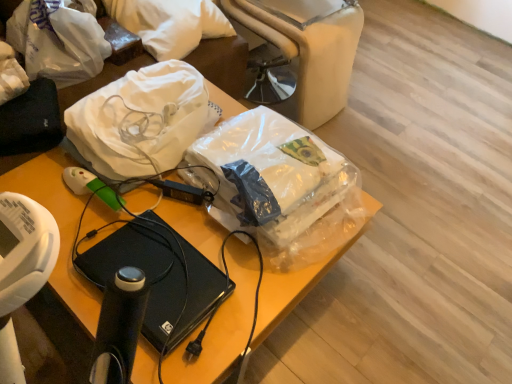
Question: Is translucent plastic bag at center, positioned as the 3th plastic bag in left-to-right order, aimed at white matte plastic bag at upper left, which ranks as the 3th plastic bag in right-to-left order?

Choices:
 (A) yes
 (B) no

Answer: (B)

Question: Is the position of translucent plastic bag at center, positioned as the 3th plastic bag in left-to-right order, less distant than that of white matte plastic bag at upper left, which is the 1th plastic bag in left-to-right order?

Choices:
 (A) no
 (B) yes

Answer: (B)

Question: From the image's perspective, would you say translucent plastic bag at center, which appears as the 1th plastic bag when viewed from the right, is shown under white matte plastic bag at upper left, which is the 1th plastic bag in left-to-right order?

Choices:
 (A) yes
 (B) no

Answer: (A)

Question: Considering the relative sizes of translucent plastic bag at center, positioned as the 3th plastic bag in left-to-right order, and white matte plastic bag at upper left, which is the 1th plastic bag in left-to-right order, in the image provided, is translucent plastic bag at center, positioned as the 3th plastic bag in left-to-right order, taller than white matte plastic bag at upper left, which is the 1th plastic bag in left-to-right order,?

Choices:
 (A) no
 (B) yes

Answer: (A)

Question: Is translucent plastic bag at center, positioned as the 3th plastic bag in left-to-right order, looking in the opposite direction of white matte plastic bag at upper left, which ranks as the 3th plastic bag in right-to-left order?

Choices:
 (A) yes
 (B) no

Answer: (A)

Question: From the image's perspective, would you say translucent plastic bag at center, which appears as the 1th plastic bag when viewed from the right, is positioned over white matte plastic bag at upper left, which is the 1th plastic bag in left-to-right order?

Choices:
 (A) yes
 (B) no

Answer: (B)

Question: Is white matte plastic bag at upper left, which is the 1th plastic bag in left-to-right order, touching transparent plastic bag at upper center, the 2th plastic bag in the left-to-right sequence?

Choices:
 (A) no
 (B) yes

Answer: (A)

Question: Does white matte plastic bag at upper left, which ranks as the 3th plastic bag in right-to-left order, appear on the right side of transparent plastic bag at upper center, placed as the second plastic bag when sorted from right to left?

Choices:
 (A) yes
 (B) no

Answer: (B)

Question: From a real-world perspective, is white matte plastic bag at upper left, which is the 1th plastic bag in left-to-right order, physically above transparent plastic bag at upper center, the 2th plastic bag in the left-to-right sequence?

Choices:
 (A) no
 (B) yes

Answer: (B)

Question: From the image's perspective, would you say white matte plastic bag at upper left, which is the 1th plastic bag in left-to-right order, is positioned over transparent plastic bag at upper center, the 2th plastic bag in the left-to-right sequence?

Choices:
 (A) yes
 (B) no

Answer: (A)

Question: Is white matte plastic bag at upper left, which is the 1th plastic bag in left-to-right order, facing away from transparent plastic bag at upper center, placed as the second plastic bag when sorted from right to left?

Choices:
 (A) yes
 (B) no

Answer: (B)

Question: Is white matte plastic bag at upper left, which ranks as the 3th plastic bag in right-to-left order, bigger than transparent plastic bag at upper center, placed as the second plastic bag when sorted from right to left?

Choices:
 (A) no
 (B) yes

Answer: (A)

Question: Is translucent plastic bag at center, positioned as the 3th plastic bag in left-to-right order, in front of transparent plastic bag at upper center, the 2th plastic bag in the left-to-right sequence?

Choices:
 (A) yes
 (B) no

Answer: (A)